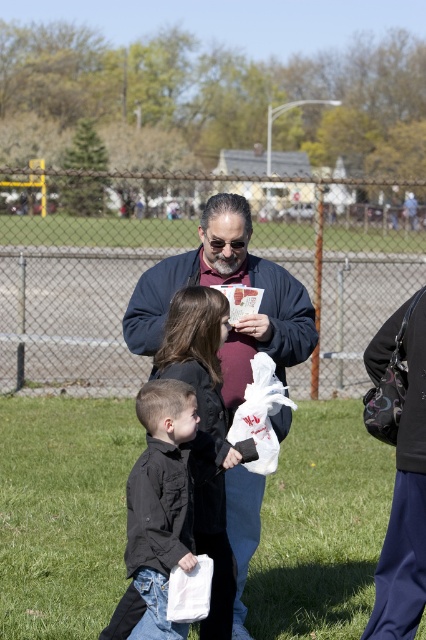
Does dark blue jacket at center lie in front of black matte shirt at center?

No, dark blue jacket at center is behind black matte shirt at center.

This screenshot has height=640, width=426. I want to click on dark blue jacket at center, so click(x=224, y=282).

At what (x,y) coordinates should I click in order to perform the action: click on dark blue jacket at center. Please return your answer as a coordinate pair (x, y). Looking at the image, I should click on (224, 282).